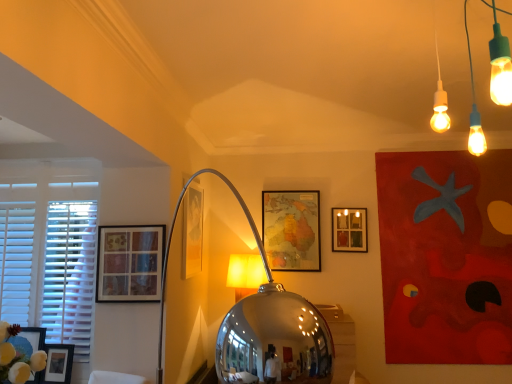
Question: Which direction should I rotate to face matte glass picture frame at upper center, the 2th picture frame positioned from the back, — up or down?

Choices:
 (A) up
 (B) down

Answer: (B)

Question: Considering the relative positions of matte glass picture frame at left, arranged as the 5th picture frame when viewed from the back, and shiny metallic table lamp at center in the image provided, is matte glass picture frame at left, arranged as the 5th picture frame when viewed from the back, to the right of shiny metallic table lamp at center from the viewer's perspective?

Choices:
 (A) no
 (B) yes

Answer: (A)

Question: Is shiny metallic table lamp at center at the back of matte glass picture frame at left, acting as the fourth picture frame starting from the right?

Choices:
 (A) no
 (B) yes

Answer: (A)

Question: From the image's perspective, is matte glass picture frame at left, arranged as the 5th picture frame when viewed from the back, above shiny metallic table lamp at center?

Choices:
 (A) yes
 (B) no

Answer: (A)

Question: Considering the relative sizes of matte glass picture frame at left, acting as the fourth picture frame starting from the right, and shiny metallic table lamp at center in the image provided, is matte glass picture frame at left, acting as the fourth picture frame starting from the right, thinner than shiny metallic table lamp at center?

Choices:
 (A) no
 (B) yes

Answer: (B)

Question: Could shiny metallic table lamp at center be considered to be inside matte glass picture frame at left, arranged as the 5th picture frame when viewed from the back?

Choices:
 (A) yes
 (B) no

Answer: (B)

Question: Considering the relative sizes of matte glass picture frame at left, the 1th picture frame from the front, and shiny metallic table lamp at center in the image provided, is matte glass picture frame at left, the 1th picture frame from the front, shorter than shiny metallic table lamp at center?

Choices:
 (A) yes
 (B) no

Answer: (A)

Question: Considering the relative sizes of white matte window at left and matte glass picture frame at left, which is the second picture frame in left-to-right order, in the image provided, is white matte window at left bigger than matte glass picture frame at left, which is the second picture frame in left-to-right order,?

Choices:
 (A) yes
 (B) no

Answer: (A)

Question: Can you confirm if white matte window at left is smaller than matte glass picture frame at left, which is the second picture frame in left-to-right order?

Choices:
 (A) no
 (B) yes

Answer: (A)

Question: Would you say white matte window at left is a long distance from matte glass picture frame at left, which is the second picture frame in left-to-right order?

Choices:
 (A) yes
 (B) no

Answer: (B)

Question: Is the depth of white matte window at left less than that of matte glass picture frame at left, acting as the fourth picture frame starting from the right?

Choices:
 (A) no
 (B) yes

Answer: (A)

Question: Is white matte window at left facing away from matte glass picture frame at left, which is the second picture frame in left-to-right order?

Choices:
 (A) no
 (B) yes

Answer: (A)

Question: Is white matte window at left not inside matte glass picture frame at left, arranged as the 5th picture frame when viewed from the back?

Choices:
 (A) no
 (B) yes

Answer: (B)

Question: Does matte glass picture frame at center, which ranks as the third picture frame in left-to-right order, appear on the right side of matte glass picture frame at upper center, the fifth picture frame in the left-to-right sequence?

Choices:
 (A) no
 (B) yes

Answer: (A)